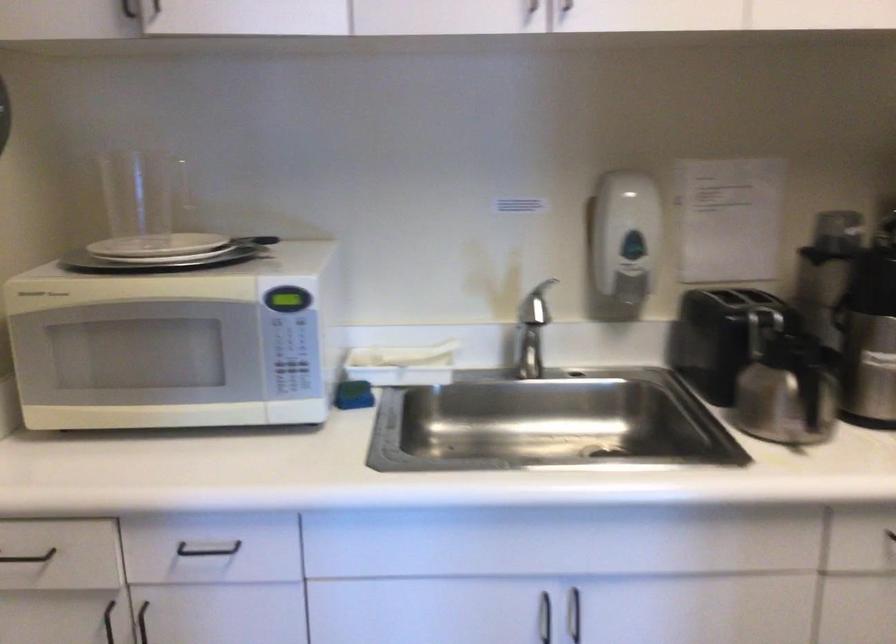
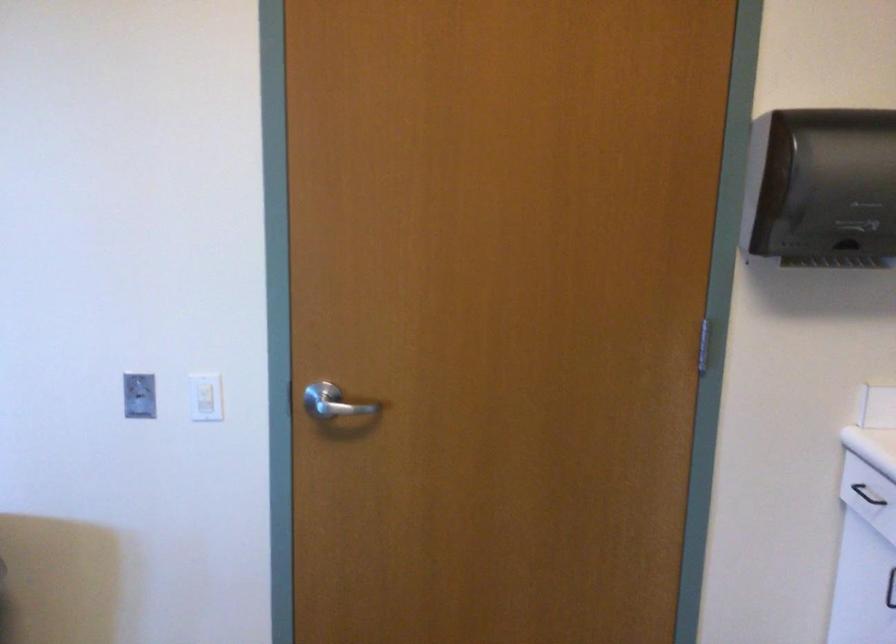
Question: The camera is either moving clockwise (left) or counter-clockwise (right) around the object. The first image is from the beginning of the video and the second image is from the end. Is the camera moving left or right when shooting the video?

Choices:
 (A) Left
 (B) Right

Answer: (B)